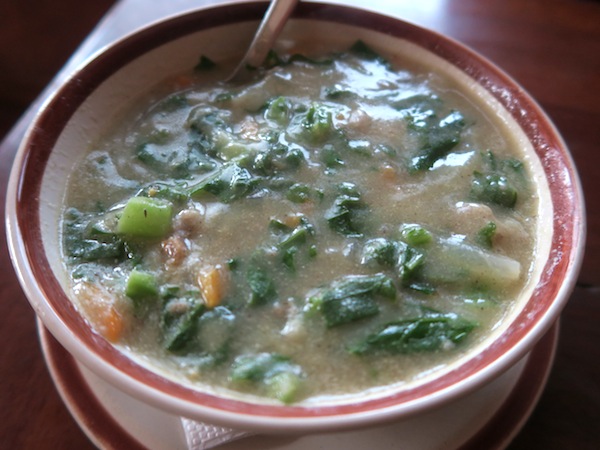
Locate an element on the screen. Image resolution: width=600 pixels, height=450 pixels. ceramic plate is located at coordinates (382, 201).